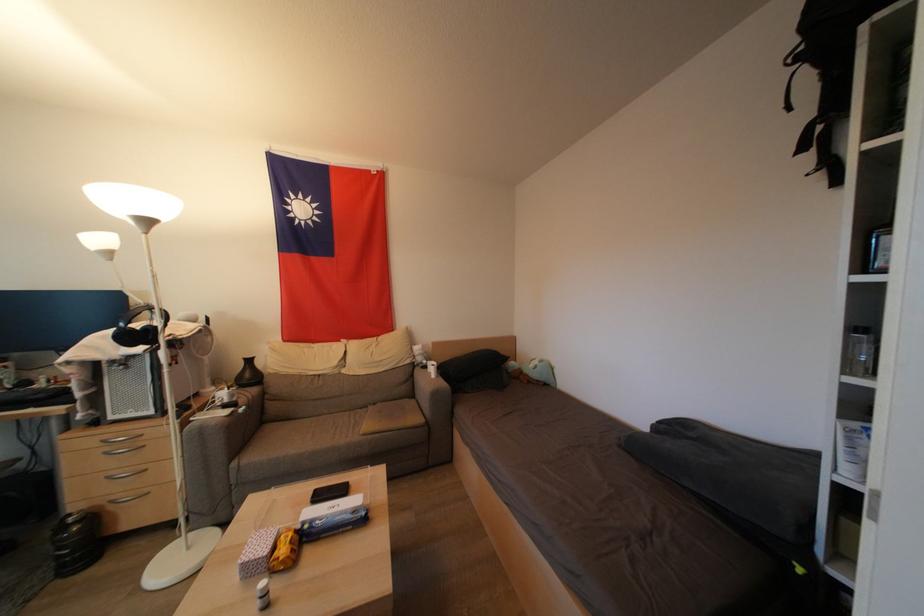
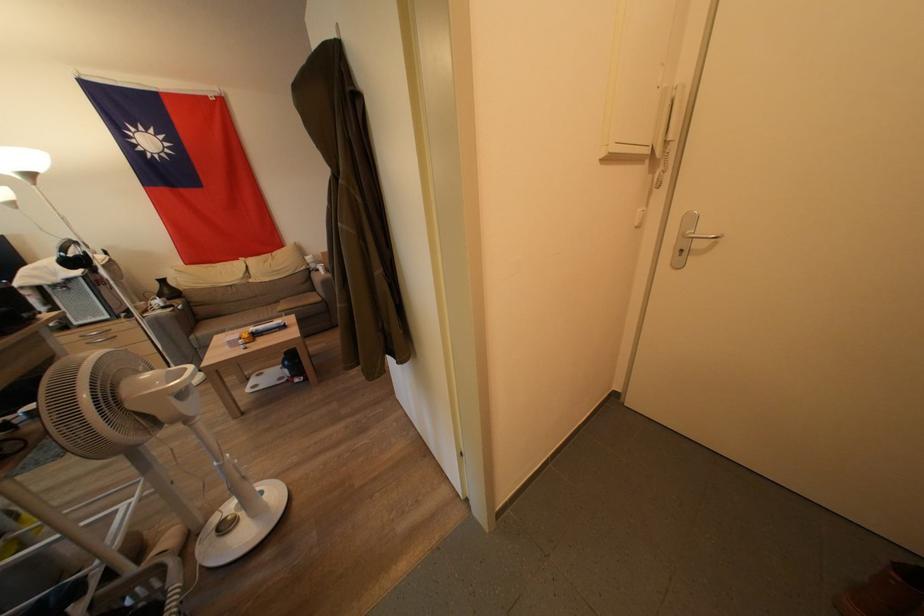
The point at (282, 402) is marked in the first image. Where is the corresponding point in the second image?

(207, 309)